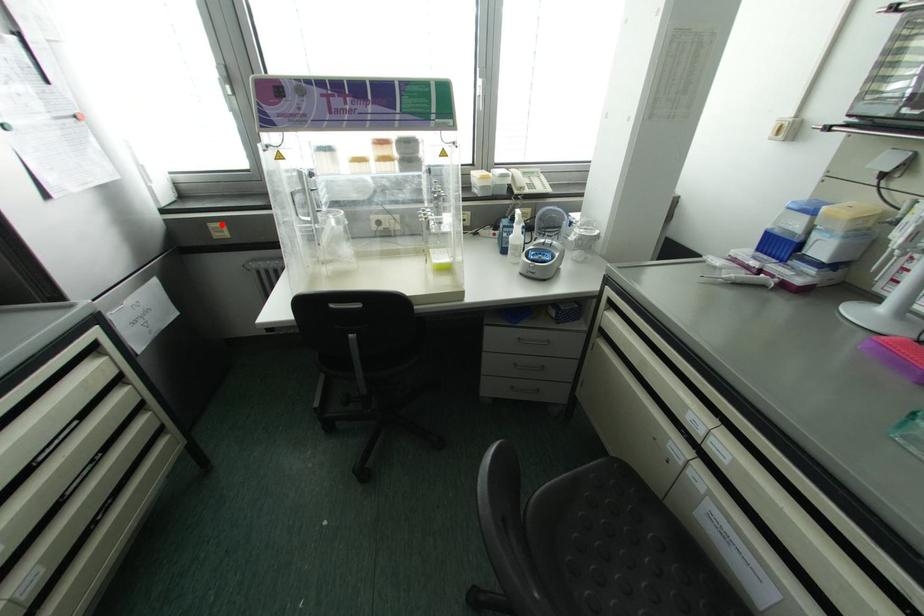
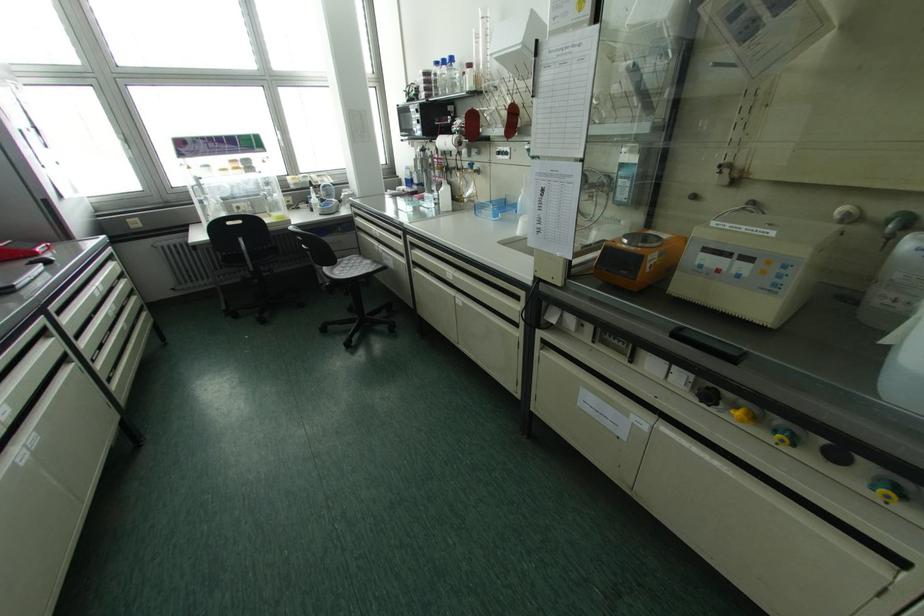
Where in the second image is the point corresponding to the highlighted location from the first image?

(137, 219)